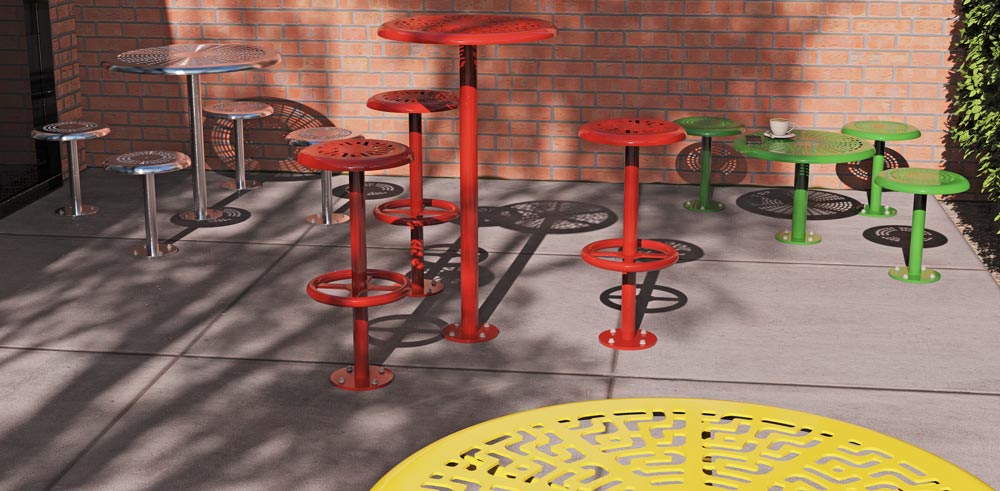
Identify the location of green circle seating. The height and width of the screenshot is (491, 1000). (695, 127), (888, 121), (911, 191).